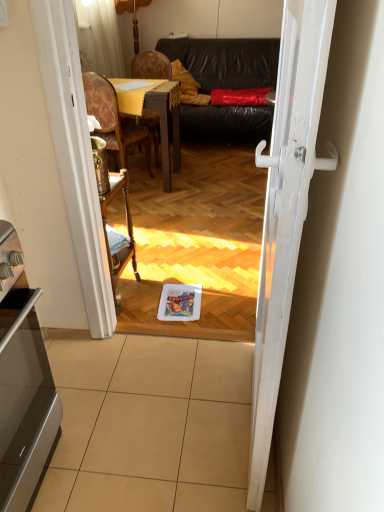
Question: In terms of size, does woodenmaterial/texturetable at upper center appear bigger or smaller than woodenchair at center, marked as the 2th chair in a back-to-front arrangement?

Choices:
 (A) big
 (B) small

Answer: (A)

Question: From their relative heights in the image, would you say woodenmaterial/texturetable at upper center is taller or shorter than woodenchair at center, marked as the 2th chair in a back-to-front arrangement?

Choices:
 (A) tall
 (B) short

Answer: (B)

Question: Estimate the real-world distances between objects in this image. Which object is closer to the wooden upholstered chair at center, arranged as the 1th chair when viewed from the back?

Choices:
 (A) beige tile at lower center
 (B) woodenmaterial/texturetable at upper center
 (C) white glossy door at center
 (D) satin silver oven at lower left
 (E) woodenchair at center, placed as the 1th chair when sorted from front to back

Answer: (E)

Question: Which object is positioned closest to the satin silver oven at lower left?

Choices:
 (A) woodenmaterial/texturetable at upper center
 (B) leather couch at center
 (C) wooden upholstered chair at center, arranged as the 2th chair when viewed from the front
 (D) beige tile at lower center
 (E) woodenchair at center, placed as the 1th chair when sorted from front to back

Answer: (D)